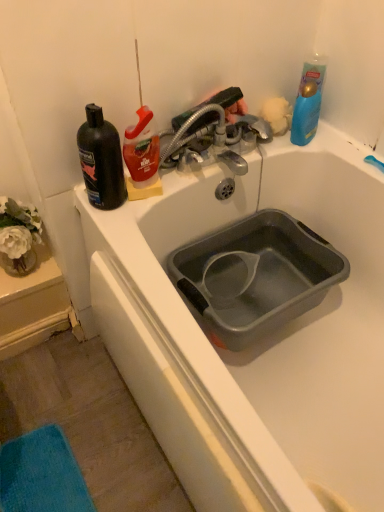
Question: Is metallic silver faucet at upper center bigger than fluffy yellow sponge at upper right?

Choices:
 (A) yes
 (B) no

Answer: (A)

Question: Considering the relative sizes of metallic silver faucet at upper center and fluffy yellow sponge at upper right in the image provided, is metallic silver faucet at upper center taller than fluffy yellow sponge at upper right?

Choices:
 (A) yes
 (B) no

Answer: (A)

Question: Considering the relative positions of metallic silver faucet at upper center and fluffy yellow sponge at upper right in the image provided, is metallic silver faucet at upper center to the left of fluffy yellow sponge at upper right from the viewer's perspective?

Choices:
 (A) yes
 (B) no

Answer: (A)

Question: Is metallic silver faucet at upper center wider than fluffy yellow sponge at upper right?

Choices:
 (A) no
 (B) yes

Answer: (B)

Question: Is metallic silver faucet at upper center oriented away from fluffy yellow sponge at upper right?

Choices:
 (A) no
 (B) yes

Answer: (A)

Question: Is point (119, 202) closer or farther from the camera than point (165, 156)?

Choices:
 (A) farther
 (B) closer

Answer: (B)

Question: From their relative heights in the image, would you say black matte bottle at left is taller or shorter than metallic silver faucet at upper center?

Choices:
 (A) tall
 (B) short

Answer: (A)

Question: Considering the relative positions of black matte bottle at left and metallic silver faucet at upper center in the image provided, is black matte bottle at left to the left or to the right of metallic silver faucet at upper center?

Choices:
 (A) right
 (B) left

Answer: (B)

Question: Choose the correct answer: Is black matte bottle at left inside metallic silver faucet at upper center or outside it?

Choices:
 (A) outside
 (B) inside

Answer: (A)

Question: Looking at the image, does fluffy yellow sponge at upper right seem bigger or smaller compared to black matte bottle at left?

Choices:
 (A) small
 (B) big

Answer: (A)

Question: In terms of height, does fluffy yellow sponge at upper right look taller or shorter compared to black matte bottle at left?

Choices:
 (A) tall
 (B) short

Answer: (B)

Question: In terms of width, does fluffy yellow sponge at upper right look wider or thinner when compared to black matte bottle at left?

Choices:
 (A) thin
 (B) wide

Answer: (A)

Question: Considering the positions of point tap(283, 100) and point tap(115, 206), is point tap(283, 100) closer or farther from the camera than point tap(115, 206)?

Choices:
 (A) farther
 (B) closer

Answer: (A)

Question: Looking at their shapes, would you say metallic silver faucet at upper center is wider or thinner than gray plastic basin at center?

Choices:
 (A) thin
 (B) wide

Answer: (A)

Question: Based on their sizes in the image, would you say metallic silver faucet at upper center is bigger or smaller than gray plastic basin at center?

Choices:
 (A) small
 (B) big

Answer: (A)